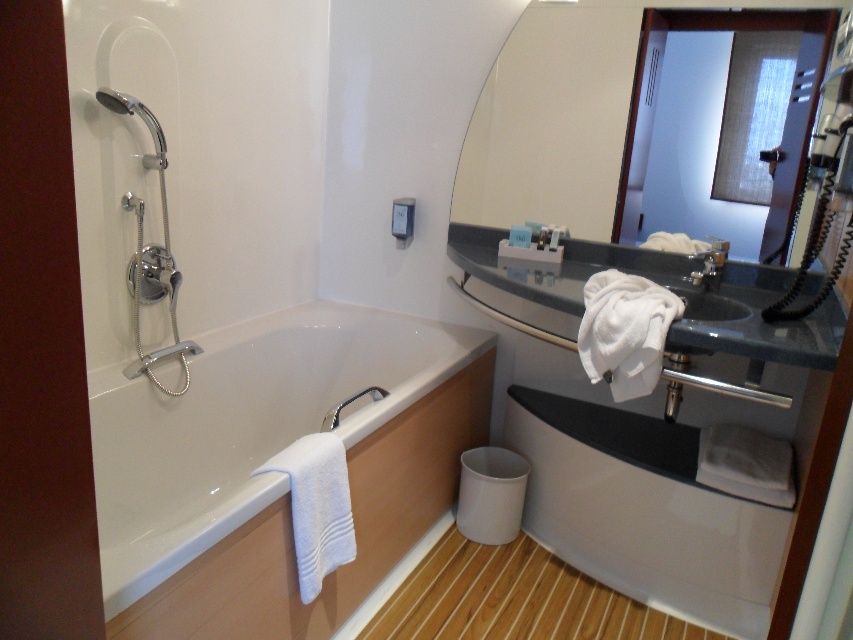
You are standing in the bathroom and want to reach the point marked at coordinates (376, 413). Considering your average arm length is about 2.5 feet, can you reach that point without moving closer?

The point at coordinates (376, 413) is 5.48 feet away from you, which is farther than your average arm length of 2.5 feet. Therefore, you cannot reach it without moving closer.

You are designing a layout for a small bathroom and want to ensure that the clear glass mirror at upper center and the matte silver shower head at left are both visible from the entrance. Since space is limited, which object should be placed higher to avoid blocking the view of the other?

The clear glass mirror at upper center should be placed higher because it is larger in size compared to the matte silver shower head at left, allowing both to be visible without obstruction.